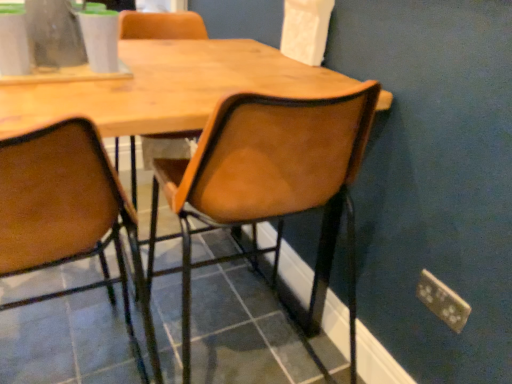
Question: From a real-world perspective, is leather-like brown chair at center, which is the 1th chair in right-to-left order, physically located above or below brown leather chair at center, the second chair positioned from the right?

Choices:
 (A) below
 (B) above

Answer: (B)

Question: In terms of height, does leather-like brown chair at center, which is the 1th chair in right-to-left order, look taller or shorter compared to brown leather chair at center, the second chair positioned from the right?

Choices:
 (A) short
 (B) tall

Answer: (B)

Question: Which object is the closest to the brown leather chair at center, which ranks as the first chair in left-to-right order?

Choices:
 (A) metallic gold power plugs and sockets at lower right
 (B) leather-like brown chair at center, which is the 1th chair in right-to-left order
 (C) clear glass vase at upper left
 (D) white matte cup at upper center

Answer: (B)

Question: Based on their relative distances, which object is nearer to the metallic gold power plugs and sockets at lower right?

Choices:
 (A) white matte cup at upper center
 (B) brown leather chair at center, the second chair positioned from the right
 (C) leather-like brown chair at center, which is the 1th chair in right-to-left order
 (D) clear glass vase at upper left

Answer: (C)